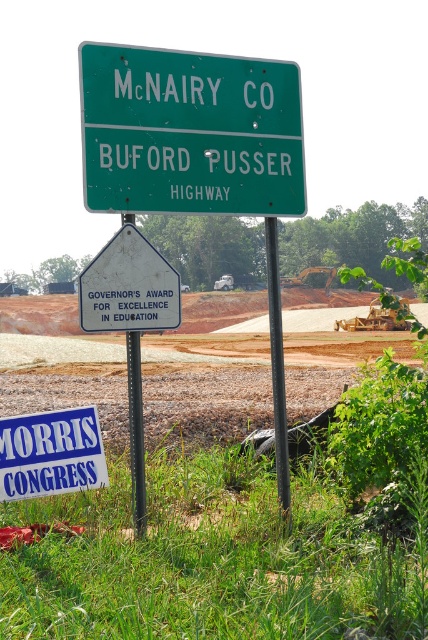
Question: Does black metal pole at center appear on the right side of black metal signpost at center?

Choices:
 (A) no
 (B) yes

Answer: (B)

Question: Based on their relative distances, which object is farther from the white plastic sign at center?

Choices:
 (A) blue plastic sign at lower left
 (B) green grass at lower center
 (C) black metal signpost at center

Answer: (B)

Question: Considering the relative positions of green matte highway sign at upper center and blue plastic sign at lower left in the image provided, where is green matte highway sign at upper center located with respect to blue plastic sign at lower left?

Choices:
 (A) left
 (B) right

Answer: (B)

Question: Which point is closer to the camera taking this photo?

Choices:
 (A) (148, 308)
 (B) (255, 81)
 (C) (273, 317)
 (D) (68, 433)

Answer: (A)

Question: Can you confirm if blue plastic sign at lower left is positioned to the right of black metal signpost at center?

Choices:
 (A) yes
 (B) no

Answer: (B)

Question: Which object is positioned closest to the blue plastic sign at lower left?

Choices:
 (A) white plastic sign at center
 (B) green grass at lower center
 (C) green matte highway sign at upper center

Answer: (B)